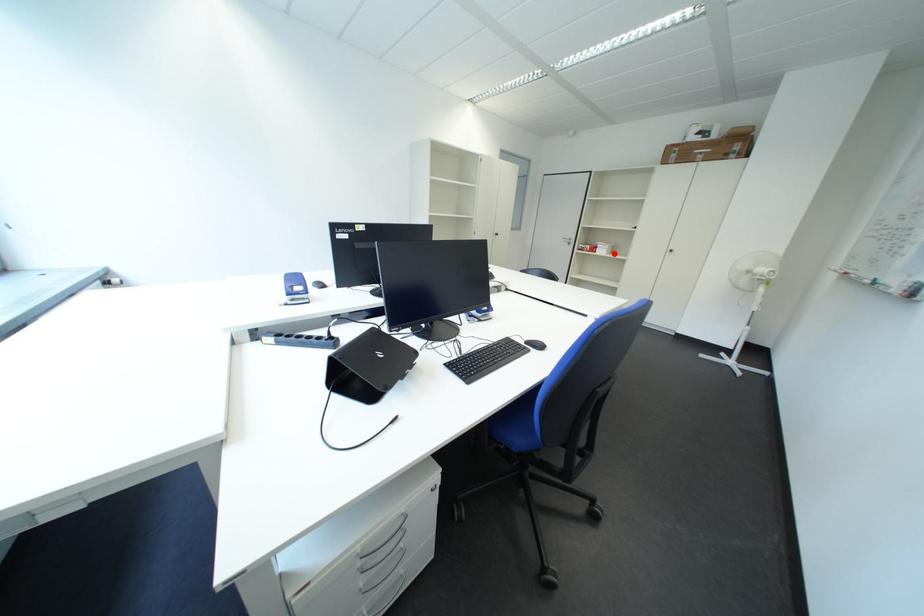
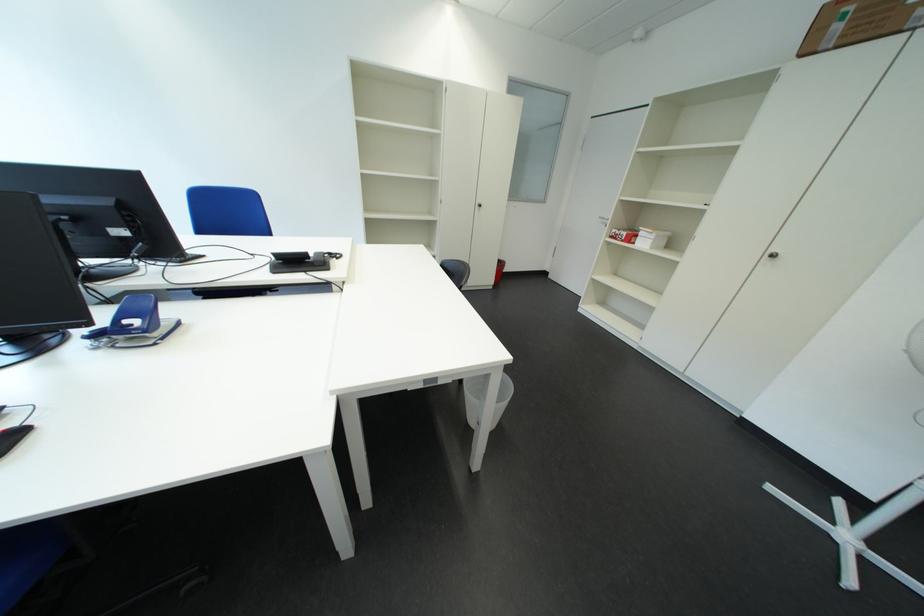
Question: I am providing you with two images of the same scene from different viewpoints. Given a red point in image1, look at the same physical point in image2. Is it:

Choices:
 (A) Closer to the viewpoint
 (B) Farther from the viewpoint

Answer: (B)